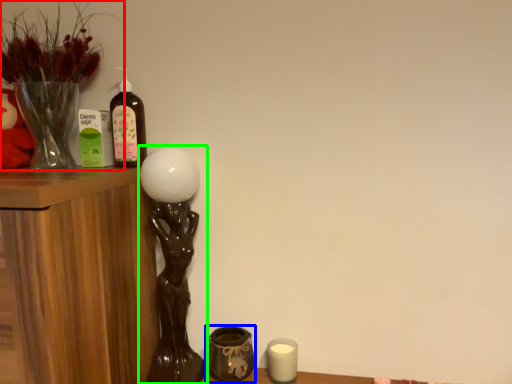
Question: Considering the real-world distances, which object is farthest from houseplant (highlighted by a red box)? candle holder (highlighted by a blue box) or table lamp (highlighted by a green box)?

Choices:
 (A) candle holder
 (B) table lamp

Answer: (A)